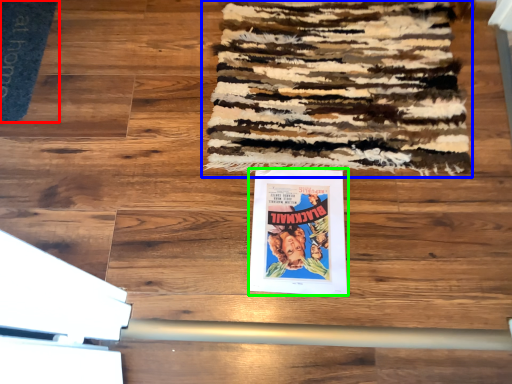
Question: Based on their relative distances, which object is farther from doormat (highlighted by a red box)? Choose from mat (highlighted by a blue box) and poster (highlighted by a green box).

Choices:
 (A) mat
 (B) poster

Answer: (B)